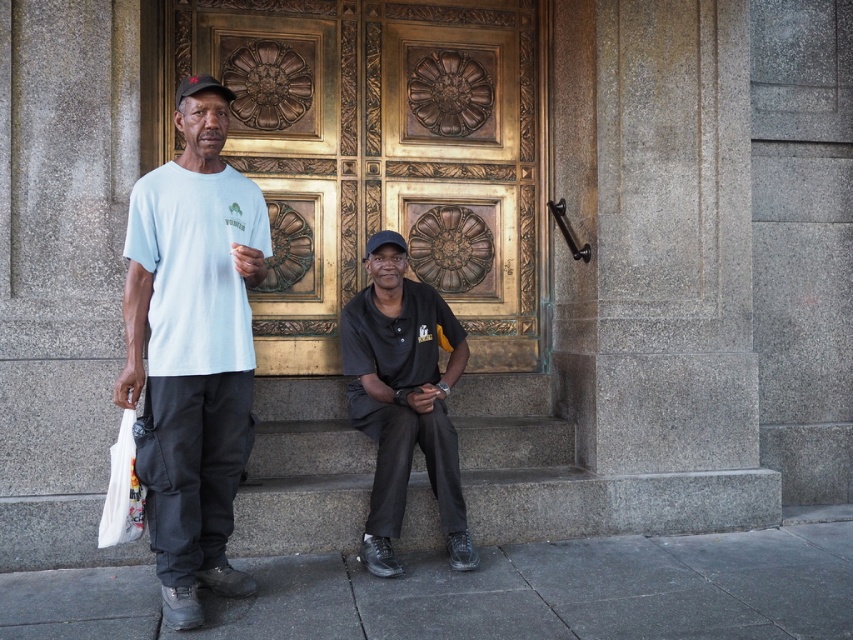
Question: Which is farther from the black matte baseball cap at upper left?

Choices:
 (A) black matte shirt at center
 (B) gray concrete pavement at lower center
 (C) light blue t-shirt at left
 (D) gray concrete stairs at lower center

Answer: (B)

Question: Among these points, which one is farthest from the camera?

Choices:
 (A) (520, 465)
 (B) (387, 371)
 (C) (354, 250)
 (D) (202, 419)

Answer: (C)

Question: Is light blue t-shirt at left positioned before black fabric baseball cap at center?

Choices:
 (A) yes
 (B) no

Answer: (A)

Question: Is black matte shirt at center behind black fabric baseball cap at center?

Choices:
 (A) no
 (B) yes

Answer: (A)

Question: Based on their relative distances, which object is nearer to the gray concrete pavement at lower center?

Choices:
 (A) black matte shirt at center
 (B) gold polished wood door at center
 (C) black fabric baseball cap at center
 (D) light blue t-shirt at left

Answer: (A)

Question: Can you confirm if gold polished wood door at center is bigger than gray concrete stairs at lower center?

Choices:
 (A) no
 (B) yes

Answer: (B)